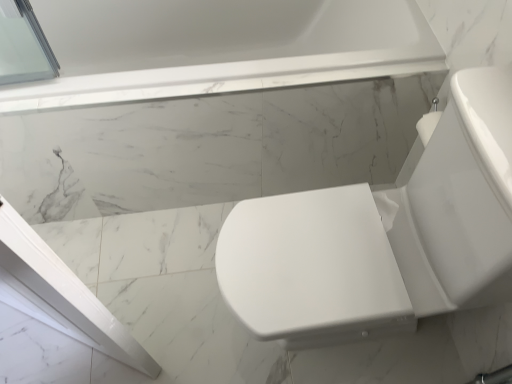
Question: Is white glossy toilet at right not close to white marble bathtub at upper center?

Choices:
 (A) yes
 (B) no

Answer: (B)

Question: Does white glossy toilet at right come in front of white marble bathtub at upper center?

Choices:
 (A) yes
 (B) no

Answer: (A)

Question: Can you confirm if white glossy toilet at right is taller than white marble bathtub at upper center?

Choices:
 (A) no
 (B) yes

Answer: (B)

Question: Is white glossy toilet at right turned away from white marble bathtub at upper center?

Choices:
 (A) no
 (B) yes

Answer: (A)

Question: Does white glossy toilet at right appear on the right side of white marble bathtub at upper center?

Choices:
 (A) yes
 (B) no

Answer: (A)

Question: From the image's perspective, is white glossy toilet at right above white marble bathtub at upper center?

Choices:
 (A) no
 (B) yes

Answer: (A)

Question: Considering the relative sizes of white marble bathtub at upper center and white glossy toilet at right in the image provided, is white marble bathtub at upper center shorter than white glossy toilet at right?

Choices:
 (A) yes
 (B) no

Answer: (A)

Question: Is white marble bathtub at upper center aimed at white glossy toilet at right?

Choices:
 (A) no
 (B) yes

Answer: (B)

Question: Considering the relative sizes of white marble bathtub at upper center and white glossy toilet at right in the image provided, is white marble bathtub at upper center smaller than white glossy toilet at right?

Choices:
 (A) yes
 (B) no

Answer: (B)

Question: Is white glossy toilet at right a part of white marble bathtub at upper center?

Choices:
 (A) no
 (B) yes

Answer: (A)

Question: Are white marble bathtub at upper center and white glossy toilet at right far apart?

Choices:
 (A) no
 (B) yes

Answer: (A)

Question: From a real-world perspective, is white marble bathtub at upper center physically above white glossy toilet at right?

Choices:
 (A) no
 (B) yes

Answer: (A)

Question: In the image, is white glossy toilet at right on the left side or the right side of white marble bathtub at upper center?

Choices:
 (A) left
 (B) right

Answer: (B)